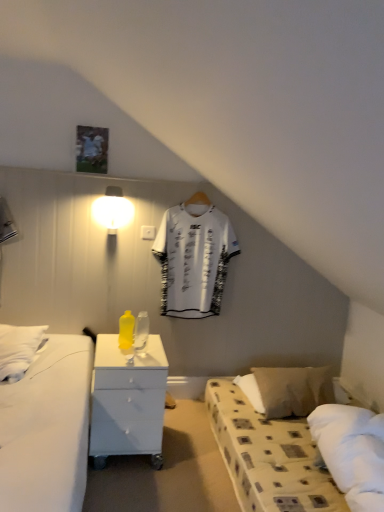
Question: In which direction should I rotate to look at transparent glass bottle at center, acting as the 1th bottle starting from the right?

Choices:
 (A) left
 (B) right

Answer: (A)

Question: Is beige fabric pillow at lower right smaller than yellow matte bottle at center, marked as the 1th bottle in a left-to-right arrangement?

Choices:
 (A) no
 (B) yes

Answer: (A)

Question: From the image's perspective, does beige fabric pillow at lower right appear higher than yellow matte bottle at center, which appears as the second bottle when viewed from the right?

Choices:
 (A) yes
 (B) no

Answer: (B)

Question: From a real-world perspective, is beige fabric pillow at lower right physically below yellow matte bottle at center, which appears as the second bottle when viewed from the right?

Choices:
 (A) yes
 (B) no

Answer: (A)

Question: Can you confirm if beige fabric pillow at lower right is taller than yellow matte bottle at center, which appears as the second bottle when viewed from the right?

Choices:
 (A) yes
 (B) no

Answer: (B)

Question: Is yellow matte bottle at center, marked as the 1th bottle in a left-to-right arrangement, located within beige fabric pillow at lower right?

Choices:
 (A) no
 (B) yes

Answer: (A)

Question: Is beige fabric pillow at lower right outside yellow matte bottle at center, marked as the 1th bottle in a left-to-right arrangement?

Choices:
 (A) no
 (B) yes

Answer: (B)

Question: Can you confirm if transparent glass bottle at center, marked as the 2th bottle in a left-to-right arrangement, is positioned to the right of white glossy nightstand at center?

Choices:
 (A) yes
 (B) no

Answer: (A)

Question: Is transparent glass bottle at center, marked as the 2th bottle in a left-to-right arrangement, closer to camera compared to white glossy nightstand at center?

Choices:
 (A) yes
 (B) no

Answer: (B)

Question: Is transparent glass bottle at center, marked as the 2th bottle in a left-to-right arrangement, wider than white glossy nightstand at center?

Choices:
 (A) yes
 (B) no

Answer: (B)

Question: Are transparent glass bottle at center, acting as the 1th bottle starting from the right, and white glossy nightstand at center located far from each other?

Choices:
 (A) no
 (B) yes

Answer: (A)

Question: Is transparent glass bottle at center, acting as the 1th bottle starting from the right, bigger than white glossy nightstand at center?

Choices:
 (A) yes
 (B) no

Answer: (B)

Question: Does transparent glass bottle at center, marked as the 2th bottle in a left-to-right arrangement, contain white glossy nightstand at center?

Choices:
 (A) no
 (B) yes

Answer: (A)

Question: Is beige fabric pillow at lower right a part of yellow matte bottle at center, which appears as the second bottle when viewed from the right?

Choices:
 (A) no
 (B) yes

Answer: (A)